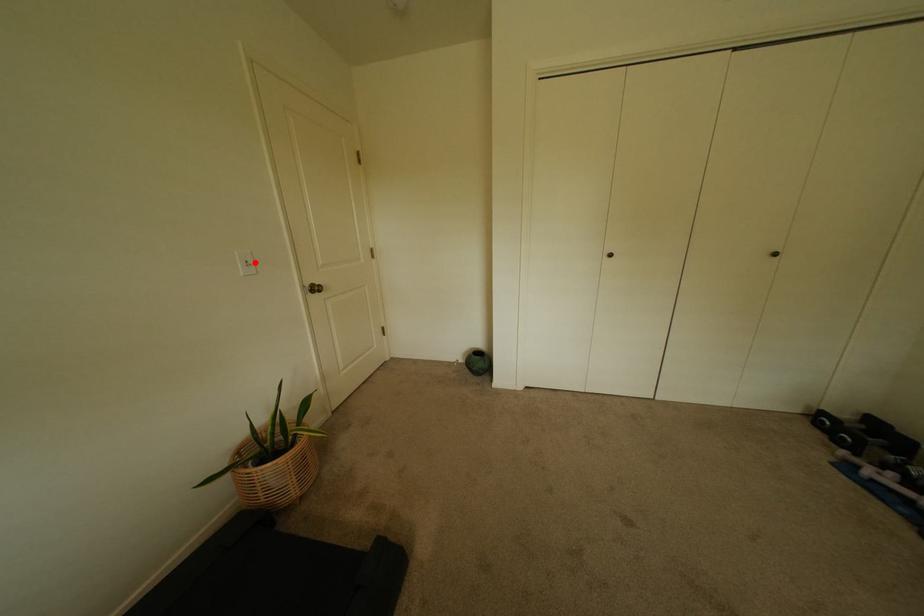
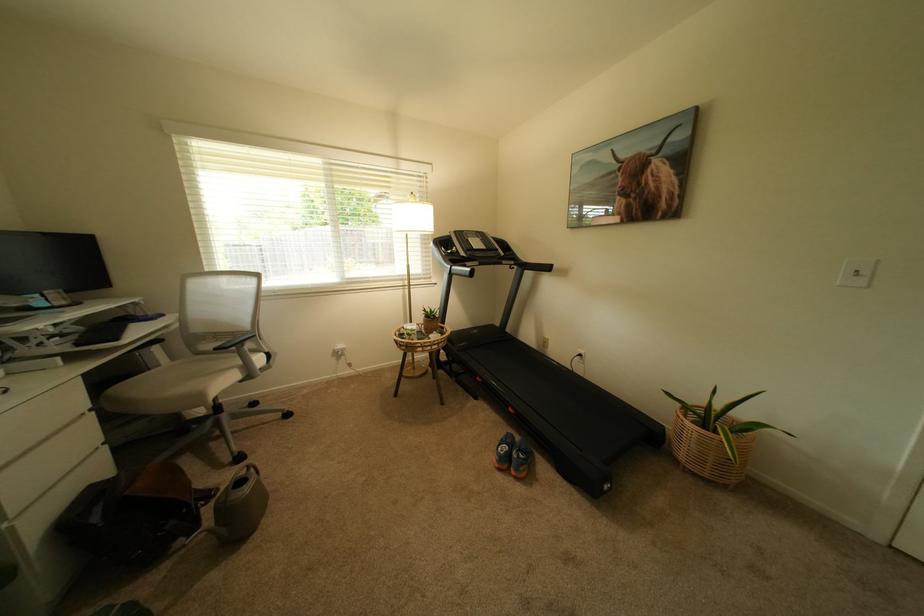
Question: I am providing you with two images of the same scene from different viewpoints. Given a red point in image1, look at the same physical point in image2. Is it:

Choices:
 (A) Closer to the viewpoint
 (B) Farther from the viewpoint

Answer: (B)